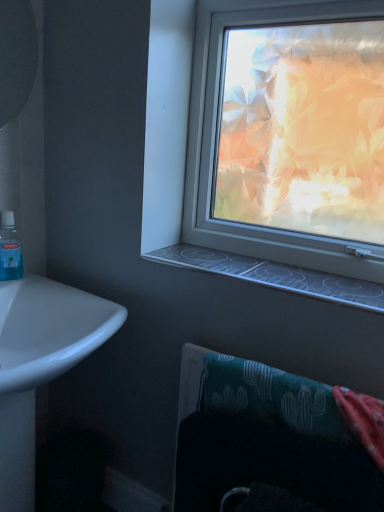
Question: From a real-world perspective, is clear plastic window sill at center physically below teal fabric towel at lower right?

Choices:
 (A) no
 (B) yes

Answer: (A)

Question: Can you confirm if clear plastic window sill at center is smaller than teal fabric towel at lower right?

Choices:
 (A) no
 (B) yes

Answer: (B)

Question: Does clear plastic window sill at center lie behind teal fabric towel at lower right?

Choices:
 (A) yes
 (B) no

Answer: (A)

Question: Is the surface of clear plastic window sill at center in direct contact with teal fabric towel at lower right?

Choices:
 (A) no
 (B) yes

Answer: (A)

Question: From the image's perspective, is clear plastic window sill at center located beneath teal fabric towel at lower right?

Choices:
 (A) yes
 (B) no

Answer: (B)

Question: From a real-world perspective, does clear plastic window sill at center stand above teal fabric towel at lower right?

Choices:
 (A) no
 (B) yes

Answer: (B)

Question: From the image's perspective, does teal fabric towel at lower right appear higher than blue translucent mouthwash at left?

Choices:
 (A) no
 (B) yes

Answer: (A)

Question: Can you confirm if teal fabric towel at lower right is thinner than blue translucent mouthwash at left?

Choices:
 (A) yes
 (B) no

Answer: (B)

Question: Does teal fabric towel at lower right appear on the right side of blue translucent mouthwash at left?

Choices:
 (A) yes
 (B) no

Answer: (A)

Question: Considering the relative sizes of teal fabric towel at lower right and blue translucent mouthwash at left in the image provided, is teal fabric towel at lower right wider than blue translucent mouthwash at left?

Choices:
 (A) yes
 (B) no

Answer: (A)

Question: Is there a large distance between teal fabric towel at lower right and blue translucent mouthwash at left?

Choices:
 (A) no
 (B) yes

Answer: (A)

Question: Does teal fabric towel at lower right come in front of blue translucent mouthwash at left?

Choices:
 (A) no
 (B) yes

Answer: (B)

Question: Can you confirm if blue translucent mouthwash at left is shorter than white glossy sink at lower left?

Choices:
 (A) yes
 (B) no

Answer: (A)